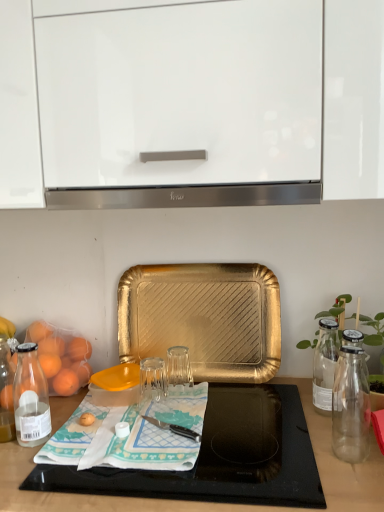
Question: Could you tell me if transparent glass at center is facing teal fabric placemat at center?

Choices:
 (A) yes
 (B) no

Answer: (A)

Question: Does transparent glass at center have a smaller size compared to teal fabric placemat at center?

Choices:
 (A) yes
 (B) no

Answer: (A)

Question: From the image's perspective, would you say transparent glass at center is positioned over teal fabric placemat at center?

Choices:
 (A) yes
 (B) no

Answer: (A)

Question: From a real-world perspective, is transparent glass at center located higher than teal fabric placemat at center?

Choices:
 (A) no
 (B) yes

Answer: (B)

Question: Is transparent glass at center shorter than teal fabric placemat at center?

Choices:
 (A) no
 (B) yes

Answer: (A)

Question: Is transparent glass at center taller or shorter than satin silver exhaust hood at center?

Choices:
 (A) short
 (B) tall

Answer: (B)

Question: Considering the positions of point (152, 387) and point (274, 183), is point (152, 387) closer or farther from the camera than point (274, 183)?

Choices:
 (A) closer
 (B) farther

Answer: (B)

Question: Looking at their shapes, would you say transparent glass at center is wider or thinner than satin silver exhaust hood at center?

Choices:
 (A) wide
 (B) thin

Answer: (B)

Question: From a real-world perspective, is transparent glass at center positioned above or below satin silver exhaust hood at center?

Choices:
 (A) below
 (B) above

Answer: (A)

Question: Visually, is teal fabric placemat at center positioned to the left or to the right of glossy white cabinet at upper center?

Choices:
 (A) right
 (B) left

Answer: (B)

Question: In the image, is teal fabric placemat at center positioned in front of or behind glossy white cabinet at upper center?

Choices:
 (A) behind
 (B) front

Answer: (A)

Question: From a real-world perspective, relative to glossy white cabinet at upper center, is teal fabric placemat at center vertically above or below?

Choices:
 (A) below
 (B) above

Answer: (A)

Question: Considering the positions of teal fabric placemat at center and glossy white cabinet at upper center in the image, is teal fabric placemat at center taller or shorter than glossy white cabinet at upper center?

Choices:
 (A) tall
 (B) short

Answer: (B)

Question: From the image's perspective, is satin silver exhaust hood at center above or below teal fabric placemat at center?

Choices:
 (A) above
 (B) below

Answer: (A)

Question: Considering the positions of satin silver exhaust hood at center and teal fabric placemat at center in the image, is satin silver exhaust hood at center bigger or smaller than teal fabric placemat at center?

Choices:
 (A) big
 (B) small

Answer: (A)